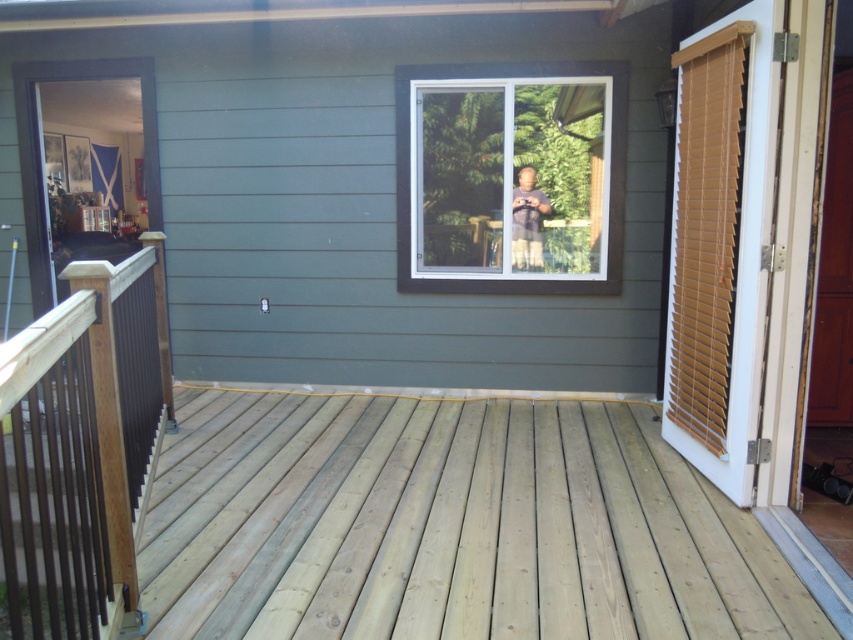
Question: Estimate the real-world distances between objects in this image. Which object is farther from the white plastic window at center?

Choices:
 (A) matte black phone at center
 (B) natural wood deck at center

Answer: (B)

Question: Which object is closer to the camera taking this photo?

Choices:
 (A) tan wood blinds at right
 (B) natural wood deck at center

Answer: (B)

Question: From the image, what is the correct spatial relationship of white plastic window at center in relation to matte black phone at center?

Choices:
 (A) right
 (B) left

Answer: (B)

Question: Among these objects, which one is nearest to the camera?

Choices:
 (A) brown wood/rail at left
 (B) white plastic window at center
 (C) matte black phone at center

Answer: (A)

Question: Does brown wood/rail at left lie behind white plastic window at center?

Choices:
 (A) no
 (B) yes

Answer: (A)

Question: Is natural wood deck at center smaller than tan wood blinds at right?

Choices:
 (A) yes
 (B) no

Answer: (B)